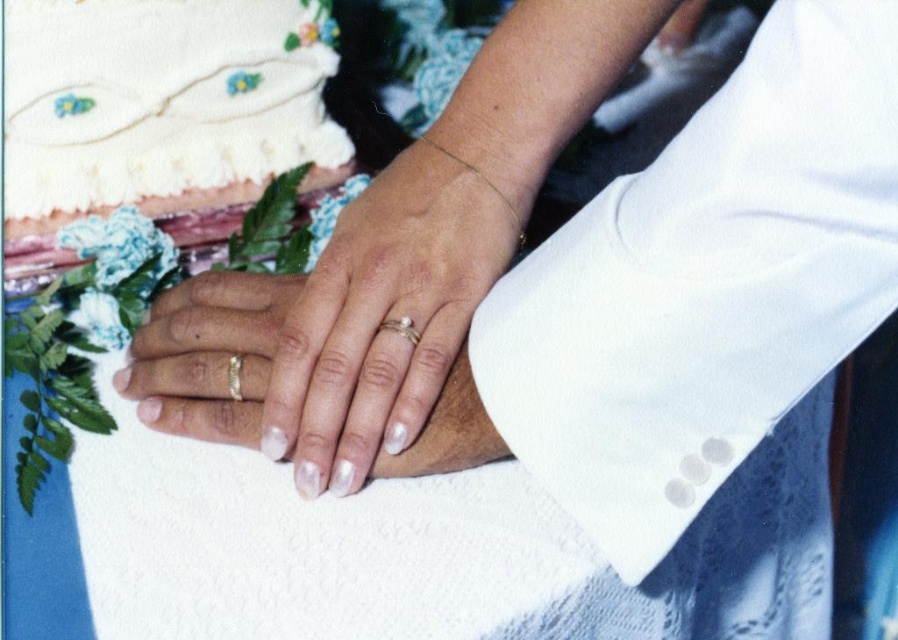
You are attending a wedding ceremony and notice two rings placed on a velvet cushion. The rings are labeled as the white matte ring at center and the gold metallic ring at center. Based on their positions, which ring is positioned to the right when viewed from the front?

The white matte ring at center is positioned to the right of the gold metallic ring at center, so the white matte ring at center is the one on the right side.

You are a jeweler examining two rings displayed on a velvet cushion. The rings are the white matte ring at center and the silver metallic ring at center. Based on their appearance, which ring would you recommend to a customer who prefers a more prominent and elevated design?

The white matte ring at center has a greater height compared to the silver metallic ring at center, so it would be the better choice for someone seeking a more prominent and elevated design.

Where is the white matte ring at center located in the image?

The white matte ring at center is located at point (393,308).